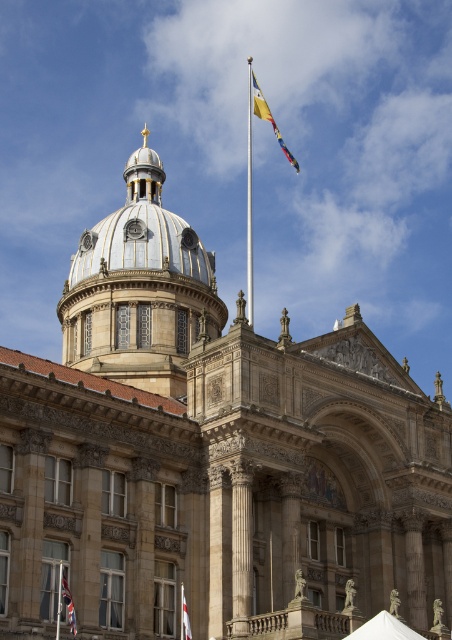
Question: Which object appears closest to the camera in this image?

Choices:
 (A) silver metallic pole at upper center
 (B) white marble dome at center
 (C) red fabric flag at center

Answer: (C)

Question: Among these points, which one is farthest from the camera?

Choices:
 (A) (255, 90)
 (B) (183, 625)
 (C) (71, 621)
 (D) (249, 291)

Answer: (A)

Question: Is the position of white marble dome at center more distant than that of silver metallic pole at upper center?

Choices:
 (A) no
 (B) yes

Answer: (B)

Question: Considering the relative positions of white marble dome at center and silver metallic pole at upper center in the image provided, where is white marble dome at center located with respect to silver metallic pole at upper center?

Choices:
 (A) above
 (B) below

Answer: (B)

Question: Does white marble dome at center have a greater width compared to white fabric flag at lower center?

Choices:
 (A) no
 (B) yes

Answer: (B)

Question: Which point is farther from the camera taking this photo?

Choices:
 (A) click(x=253, y=100)
 (B) click(x=183, y=634)
 (C) click(x=246, y=60)

Answer: (C)